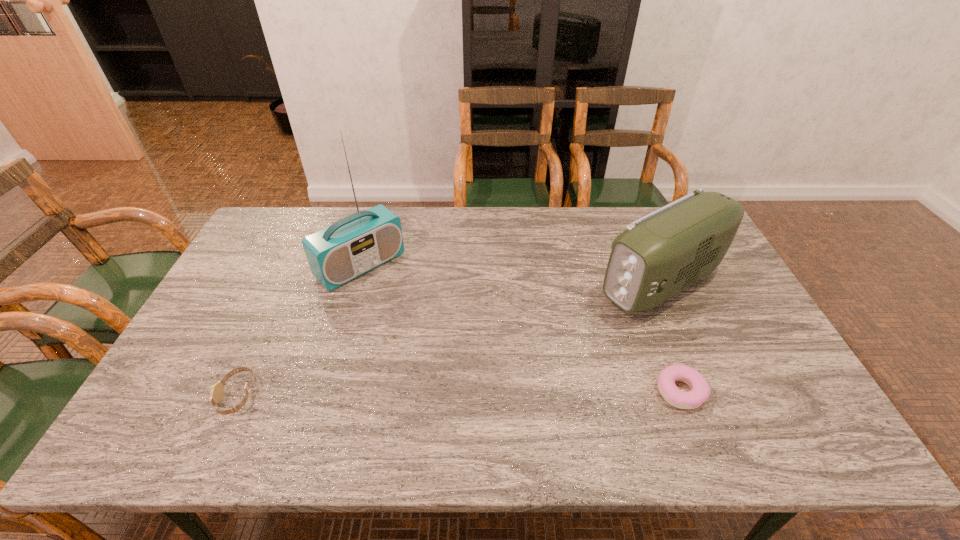
Locate an element on the screen. The height and width of the screenshot is (540, 960). vacant point that satisfies the following two spatial constraints: 1. on the front side of the taller radio receiver; 2. on the left side of the right radio receiver is located at coordinates (355, 283).